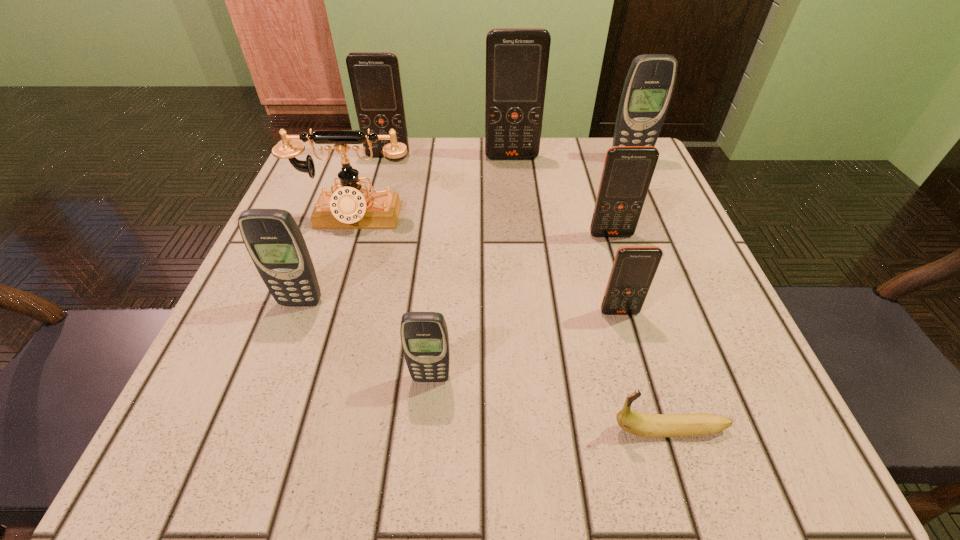
Locate an element on the screen. This screenshot has height=540, width=960. the third nearest object is located at coordinates (634, 267).

Locate an element on the screen. The image size is (960, 540). the smallest orange cellular telephone is located at coordinates (634, 267).

This screenshot has width=960, height=540. I want to click on the fourth object from left to right, so point(424,335).

The height and width of the screenshot is (540, 960). What are the coordinates of `the nearest gray cellular telephone` in the screenshot? It's located at (424, 335).

Where is `banana`? The height and width of the screenshot is (540, 960). banana is located at coordinates (642, 424).

The image size is (960, 540). Find the location of `yellow banana`. yellow banana is located at coordinates (642, 424).

Locate an element on the screen. The height and width of the screenshot is (540, 960). free space located 0.310m on the screen of the third orange cellular telephone from right to left is located at coordinates (521, 256).

Where is `blank area located 0.100m on the screen of the third smallest orange cellular telephone`? blank area located 0.100m on the screen of the third smallest orange cellular telephone is located at coordinates (380, 184).

I want to click on blank area located 0.370m on the screen of the farthest gray cellular telephone, so 684,283.

At what (x,y) coordinates should I click in order to perform the action: click on free point located 0.070m on the screen of the second farthest gray cellular telephone. Please return your answer as a coordinate pair (x, y). The width and height of the screenshot is (960, 540). Looking at the image, I should click on (286, 343).